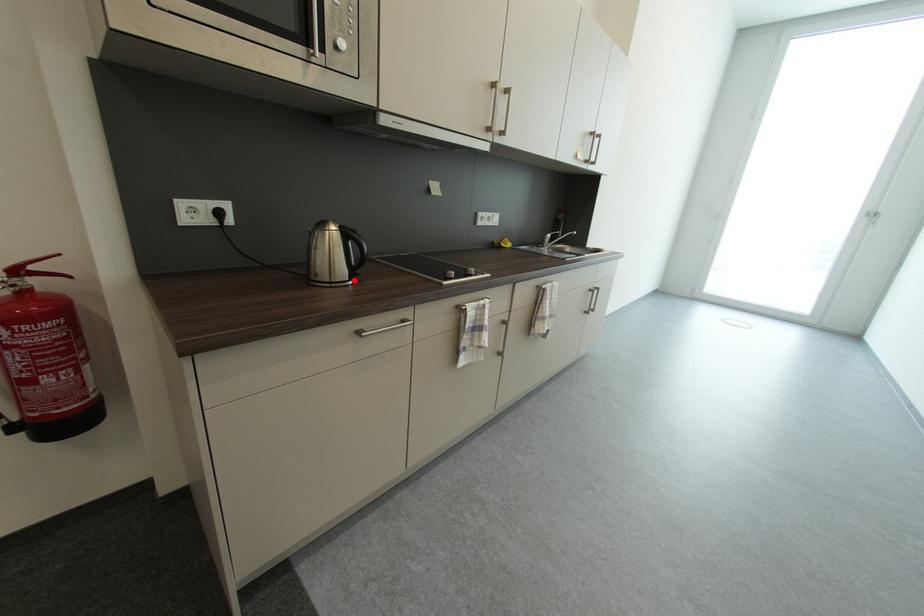
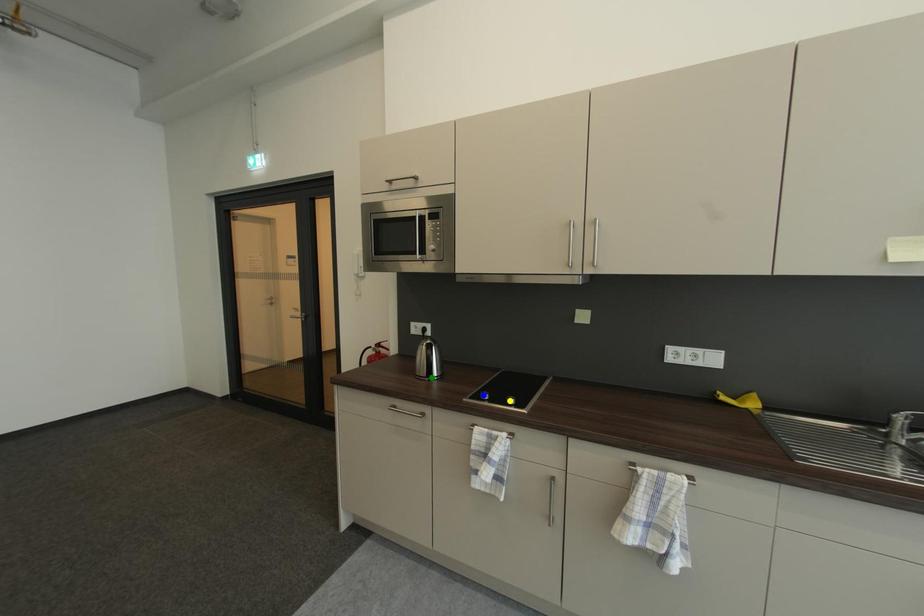
Question: I am providing you with two images of the same scene from different viewpoints. A red point is marked on the first image. You are given multiple points on the second image. In image 2, which mark is for the same physical point as the one in image 1?

Choices:
 (A) blue point
 (B) green point
 (C) yellow point

Answer: (B)